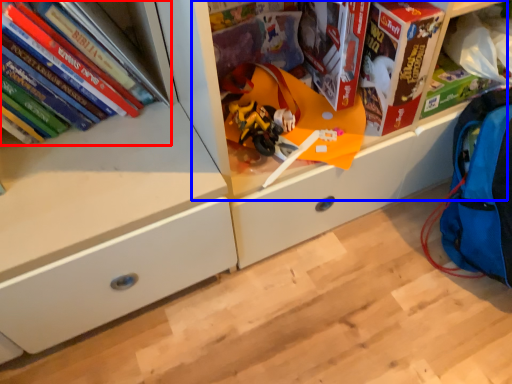
Question: Which object appears closest to the camera in this image, book (highlighted by a red box) or shelf (highlighted by a blue box)?

Choices:
 (A) book
 (B) shelf

Answer: (B)